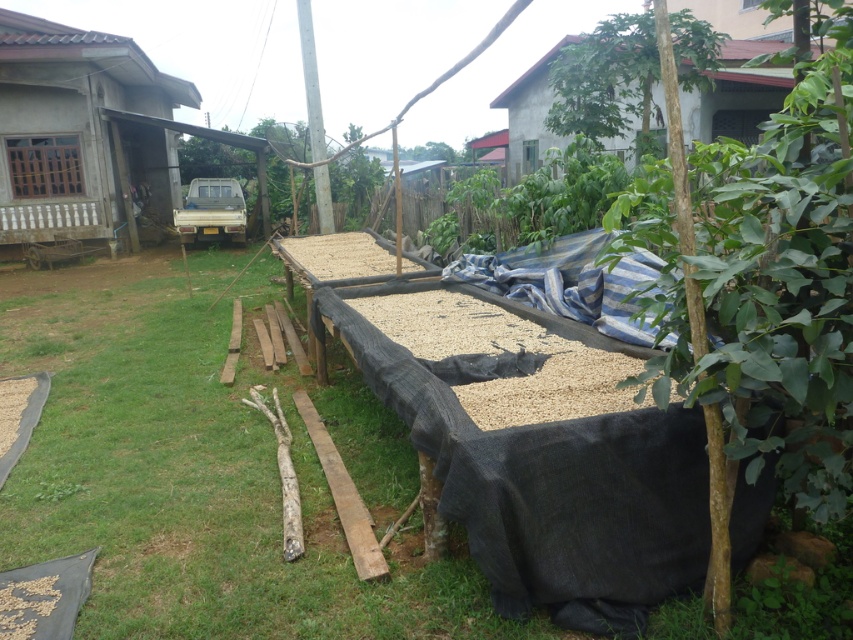
Question: Is the position of green grass at center less distant than that of gray concrete hut at upper center?

Choices:
 (A) yes
 (B) no

Answer: (A)

Question: From the image, what is the correct spatial relationship of brown rough bark tree at right in relation to green leafy tree at upper center?

Choices:
 (A) below
 (B) above

Answer: (A)

Question: Does green grass at center have a smaller size compared to gray concrete hut at upper center?

Choices:
 (A) no
 (B) yes

Answer: (B)

Question: Estimate the real-world distances between objects in this image. Which object is closer to the brown rough bark tree at right?

Choices:
 (A) light brown wooden hut at left
 (B) green grass at center
 (C) gray concrete hut at upper center

Answer: (B)

Question: Which object appears closest to the camera in this image?

Choices:
 (A) gray concrete hut at upper center
 (B) green grass at center
 (C) brown rough bark tree at right

Answer: (C)

Question: Which point appears farthest from the camera in this image?

Choices:
 (A) (706, 36)
 (B) (341, 634)
 (C) (721, 104)
 (D) (15, 182)

Answer: (D)